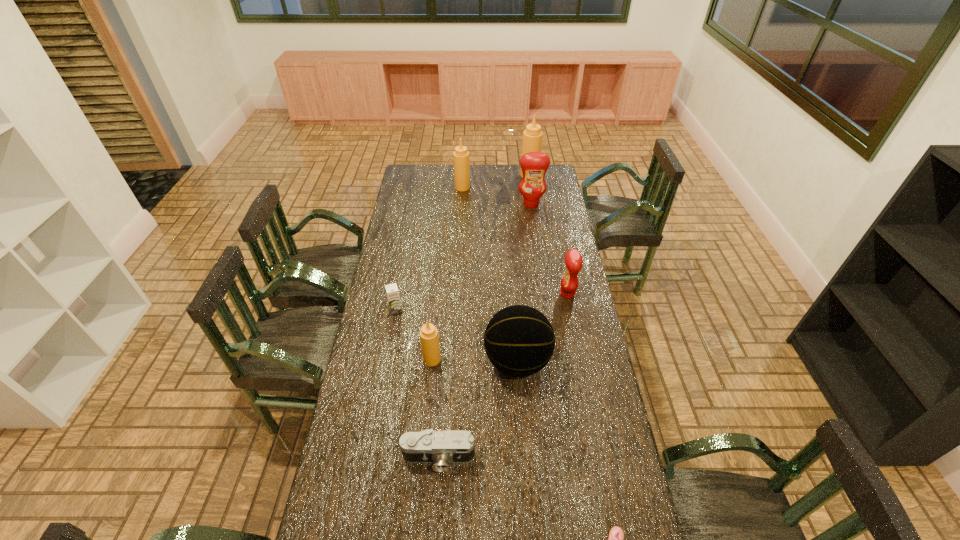
The height and width of the screenshot is (540, 960). Identify the location of blank space located on the label side of the smaller red condiment. (477, 294).

You are a GUI agent. You are given a task and a screenshot of the screen. Output one action in this format:
    pyautogui.click(x=<x>, y=<y>)
    Task: Click on the free spot located on the label side of the smaller red condiment
    The image size is (960, 540).
    Given the screenshot: What is the action you would take?
    pyautogui.click(x=548, y=294)

The image size is (960, 540). What are the coordinates of `vacant space positioned on the front of the leftmost tan condiment` in the screenshot? It's located at (421, 468).

I want to click on vacant region located 0.100m on the front of the seventh tallest object, so click(x=392, y=334).

I want to click on vacant space located 0.100m on the lens of the camera, so click(435, 509).

Locate an element on the screen. object present at the left edge is located at coordinates (392, 291).

Where is `object that is at the far right corner`? The width and height of the screenshot is (960, 540). object that is at the far right corner is located at coordinates (532, 137).

Identify the location of vacant region at the left edge of the desktop. The width and height of the screenshot is (960, 540). (390, 252).

At what (x,y) coordinates should I click in order to perform the action: click on vacant point at the right edge. Please return your answer as a coordinate pair (x, y). This screenshot has height=540, width=960. Looking at the image, I should click on (578, 394).

Find the location of `free space between the basketball and the rightmost tan condiment`. free space between the basketball and the rightmost tan condiment is located at coordinates pyautogui.click(x=523, y=268).